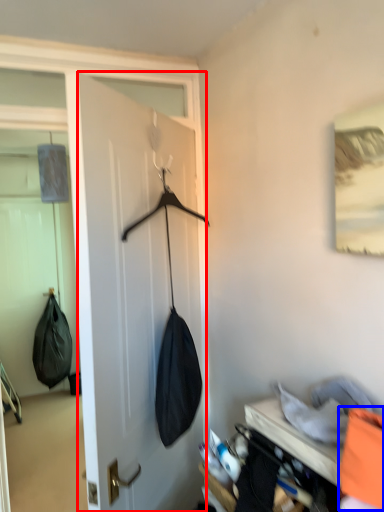
Question: Which point is closer to the camera, door (highlighted by a red box) or clothing (highlighted by a blue box)?

Choices:
 (A) door
 (B) clothing

Answer: (B)